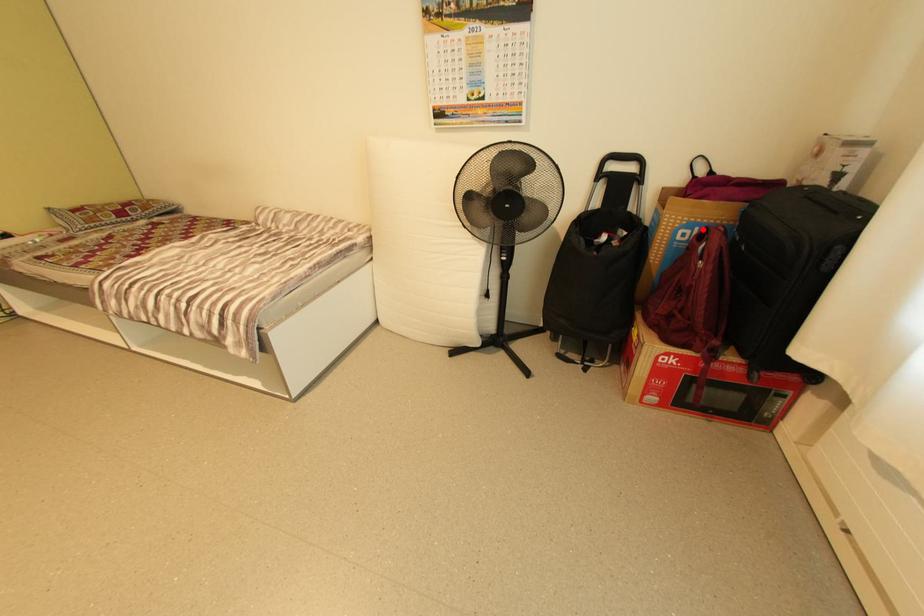
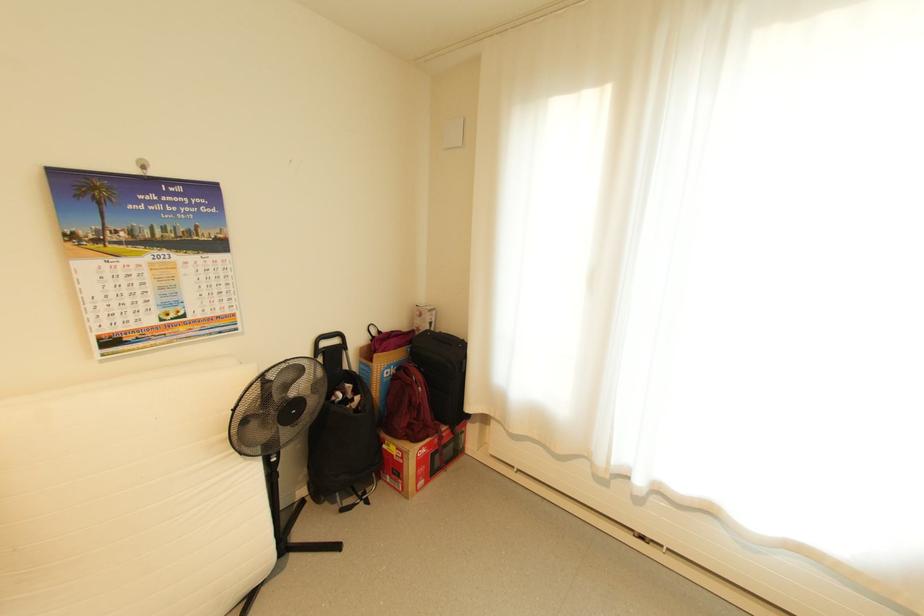
Question: A red point is marked in image1. In image2, is the corresponding 3D point closer to the camera or farther? Reply with the corresponding letter.

Choices:
 (A) The corresponding 3D point is closer.
 (B) The corresponding 3D point is farther.

Answer: (B)